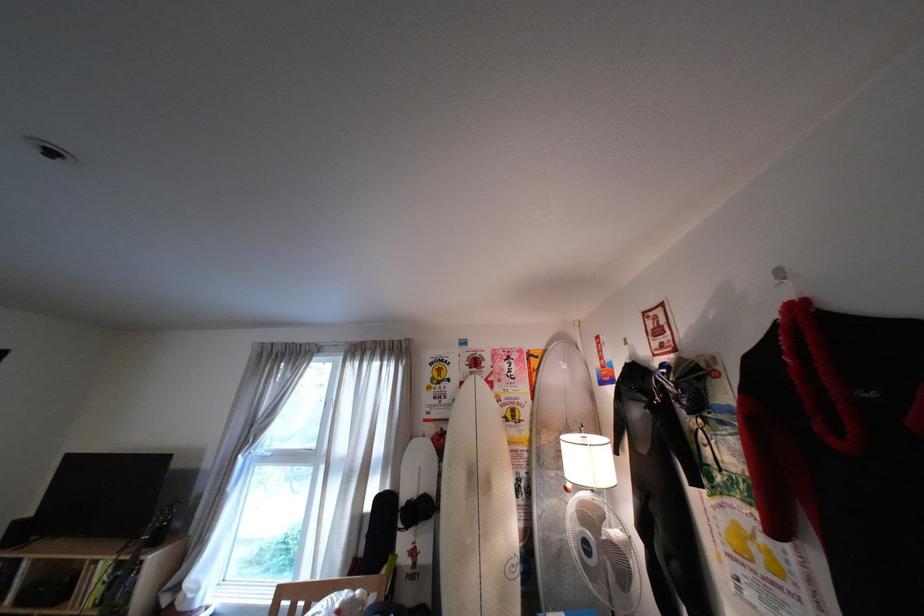
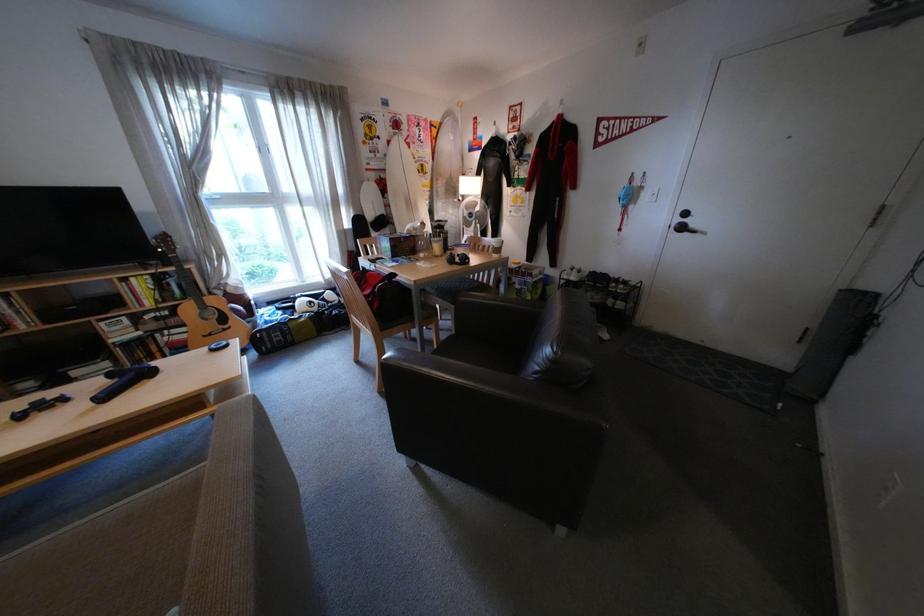
The point at (531, 379) is marked in the first image. Where is the corresponding point in the second image?

(439, 145)